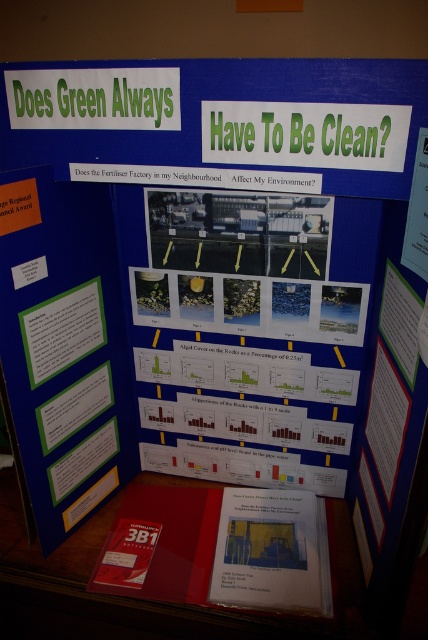
Question: Which of the following is the farthest from the observer?

Choices:
 (A) yellow paper at center
 (B) green paper at upper center

Answer: (A)

Question: Which object appears closest to the camera in this image?

Choices:
 (A) yellow paper at center
 (B) green paper at upper center

Answer: (B)

Question: Which of the following is the farthest from the observer?

Choices:
 (A) (219, 538)
 (B) (98, 116)

Answer: (A)

Question: Can you confirm if yellow paper at center is thinner than green paper at upper center?

Choices:
 (A) yes
 (B) no

Answer: (A)

Question: Can you confirm if yellow paper at center is positioned above green paper at upper center?

Choices:
 (A) yes
 (B) no

Answer: (B)

Question: Is yellow paper at center positioned at the back of green paper at upper center?

Choices:
 (A) no
 (B) yes

Answer: (B)